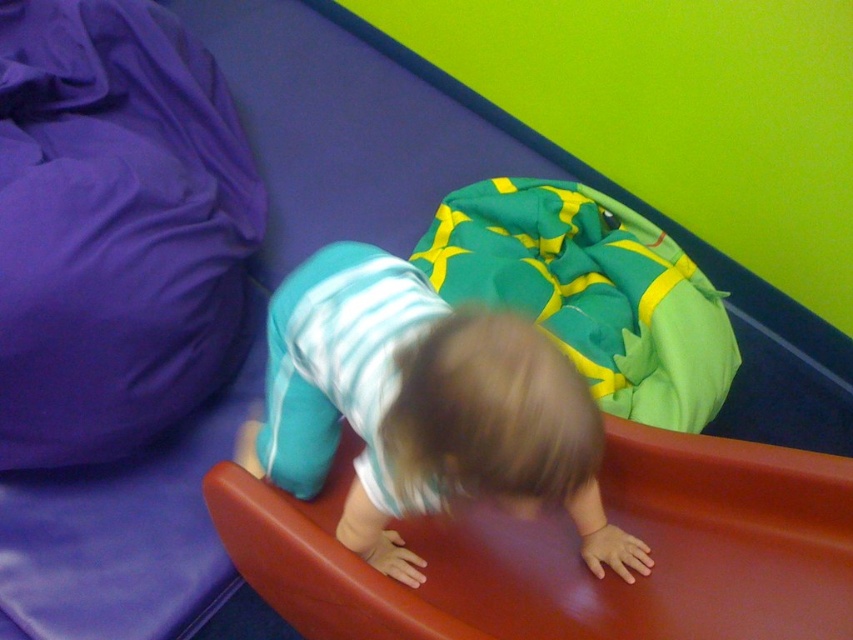
Which is more to the right, smooth red slide at lower center or teal striped shirt at center?

Positioned to the right is smooth red slide at lower center.

Measure the distance between point (602, 484) and camera.

Point (602, 484) and camera are 5.06 feet apart from each other.

Is point (715, 608) behind point (403, 556)?

No.

At what (x,y) coordinates should I click in order to perform the action: click on smooth red slide at lower center. Please return your answer as a coordinate pair (x, y). The width and height of the screenshot is (853, 640). Looking at the image, I should click on (572, 552).